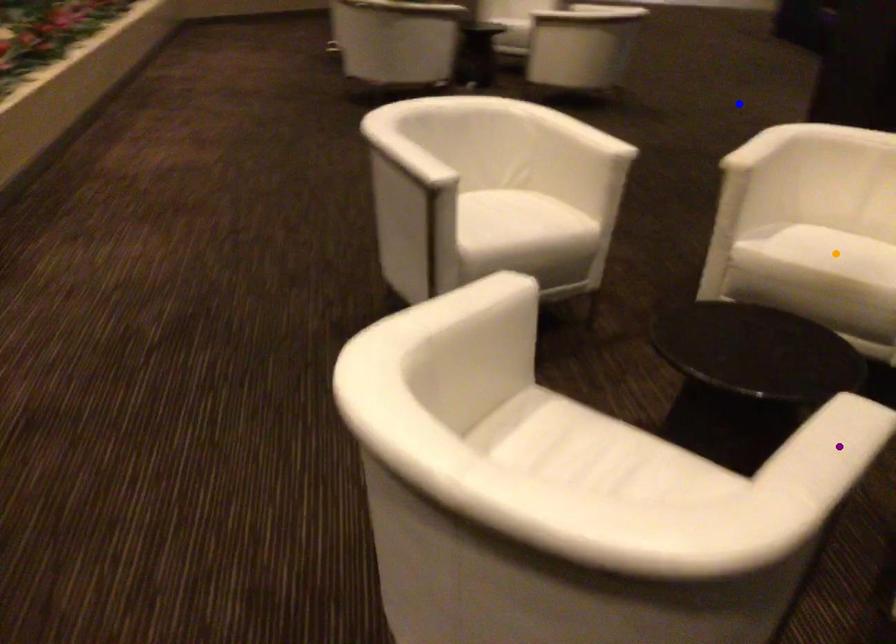
Order these from nearest to farthest:
blue point
orange point
purple point

purple point
orange point
blue point